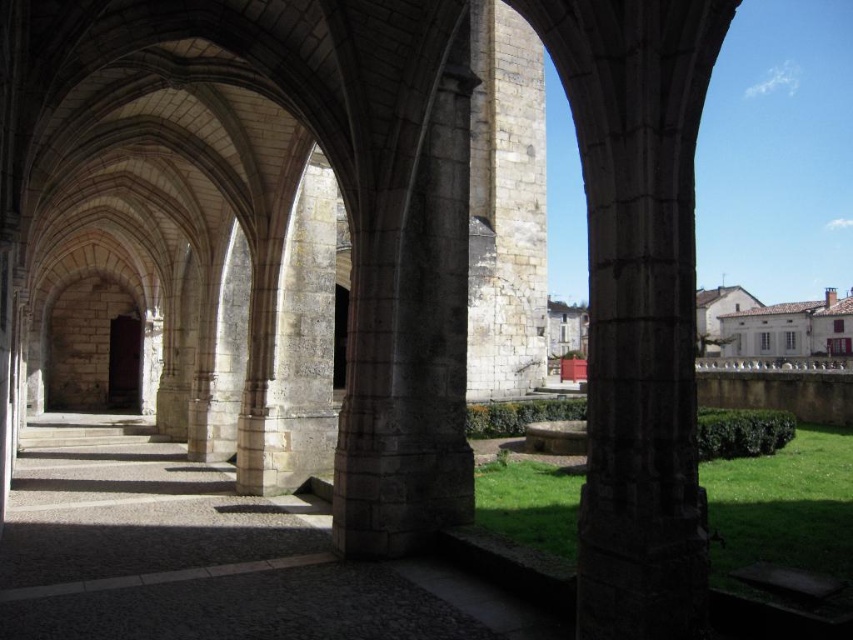
Between point (390, 536) and point (830, 352), which one is positioned behind?

The point (830, 352) is behind.

Consider the image. Does gray stone pillar at center appear over white stone building at lower right?

Yes, gray stone pillar at center is above white stone building at lower right.

Where is `gray stone pillar at center`? This screenshot has height=640, width=853. gray stone pillar at center is located at coordinates (404, 275).